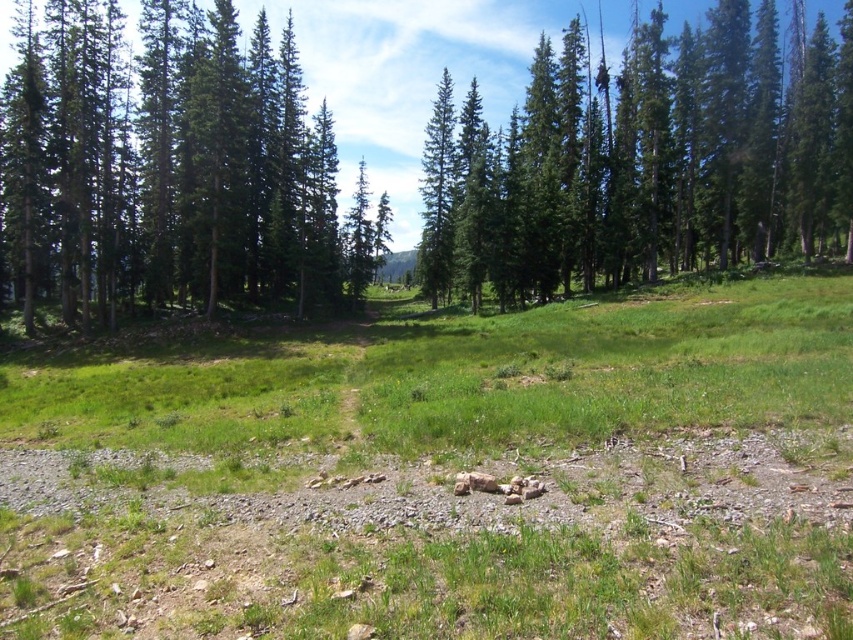
Does point (679, 260) come farther from viewer compared to point (84, 218)?

Yes.

Is green coniferous forest at center above green matte tree at upper left?

Yes, green coniferous forest at center is above green matte tree at upper left.

Which is behind, point (221, 124) or point (47, 296)?

The point (47, 296) is more distant.

What are the coordinates of `green coniferous forest at center` in the screenshot? It's located at (642, 157).

Which of these two, green coniferous forest at center or green coniferous trees at upper center, stands taller?

Standing taller between the two is green coniferous forest at center.

Which is more to the left, green coniferous forest at center or green coniferous trees at upper center?

green coniferous forest at center

You are a GUI agent. You are given a task and a screenshot of the screen. Output one action in this format:
    pyautogui.click(x=<x>, y=<y>)
    Task: Click on the green coniferous forest at center
    The image size is (853, 640).
    Given the screenshot: What is the action you would take?
    pyautogui.click(x=642, y=157)

Where is `green coniferous forest at center`? The width and height of the screenshot is (853, 640). green coniferous forest at center is located at coordinates (642, 157).

Which of these two, green matte tree at upper left or green coniferous trees at upper center, stands shorter?

With less height is green coniferous trees at upper center.

Between point (122, 268) and point (439, 193), which one is positioned behind?

The point (439, 193) is behind.

Is point (0, 108) positioned in front of point (573, 198)?

Yes, it is in front of point (573, 198).

Find the location of `green matte tree at upper left`. green matte tree at upper left is located at coordinates (169, 168).